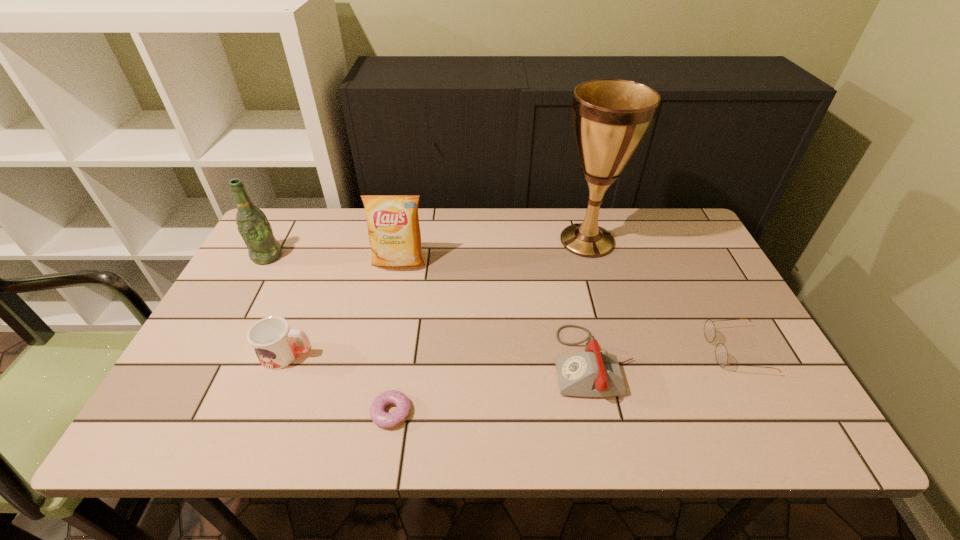
Image resolution: width=960 pixels, height=540 pixels. In order to click on empty space that is in between the fifth shortest object and the tallest object in this screenshot , I will do `click(492, 252)`.

At what (x,y) coordinates should I click in order to perform the action: click on empty location between the mug and the doughnut. Please return your answer as a coordinate pair (x, y). Looking at the image, I should click on (339, 383).

In order to click on blank region between the sixth tallest object and the beer bottle in this screenshot , I will do `click(501, 303)`.

Image resolution: width=960 pixels, height=540 pixels. Find the location of `free spot between the doughnut and the tallest object`. free spot between the doughnut and the tallest object is located at coordinates (489, 327).

Find the location of a particular element. Image resolution: width=960 pixels, height=540 pixels. object that is the sixth closest one to the spectacles is located at coordinates (253, 226).

Locate which object ranks in proximity to the telephone. Please provide its 2D coordinates. Your answer should be formatted as a tuple, i.e. [(x, y)], where the tuple contains the x and y coordinates of a point satisfying the conditions above.

[(721, 354)]

You are a GUI agent. You are given a task and a screenshot of the screen. Output one action in this format:
    pyautogui.click(x=<x>, y=<y>)
    Task: Click on the free point that satisfies the following two spatial constraints: 1. on the side of the mug with the handle; 2. on the back side of the doughnut
    The image size is (960, 540).
    Given the screenshot: What is the action you would take?
    pyautogui.click(x=264, y=412)

This screenshot has height=540, width=960. What are the coordinates of `free location that satisfies the following two spatial constraints: 1. on the side of the second object from left to right with the handle; 2. on the left side of the shortest object` in the screenshot? It's located at (264, 412).

Locate an element on the screen. The height and width of the screenshot is (540, 960). free location that satisfies the following two spatial constraints: 1. on the dial of the third shortest object; 2. on the front side of the doughnut is located at coordinates (605, 412).

Where is `vacant space that satisfies the following two spatial constraints: 1. on the back side of the doughnut; 2. on the side of the fourth shortest object with the handle`? vacant space that satisfies the following two spatial constraints: 1. on the back side of the doughnut; 2. on the side of the fourth shortest object with the handle is located at coordinates (400, 355).